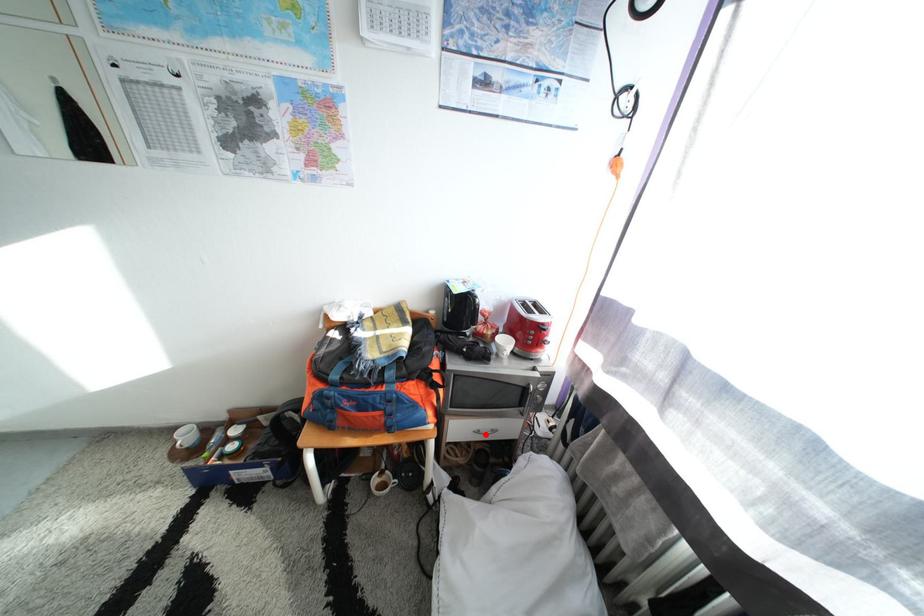
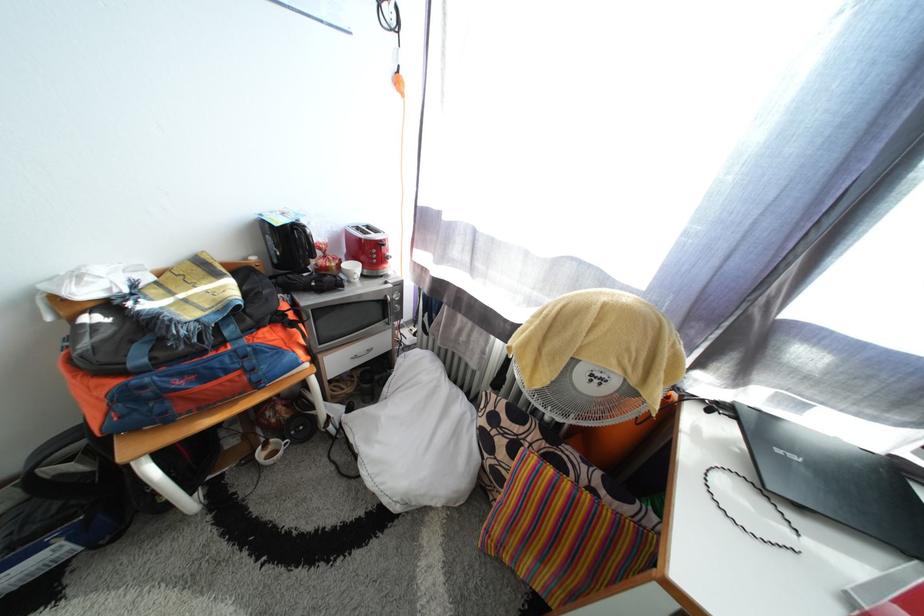
Question: I am providing you with two images of the same scene from different viewpoints. A red point is shown in image1. For the corresponding object point in image2, is it positioned nearer or farther from the camera?

Choices:
 (A) Nearer
 (B) Farther

Answer: (A)